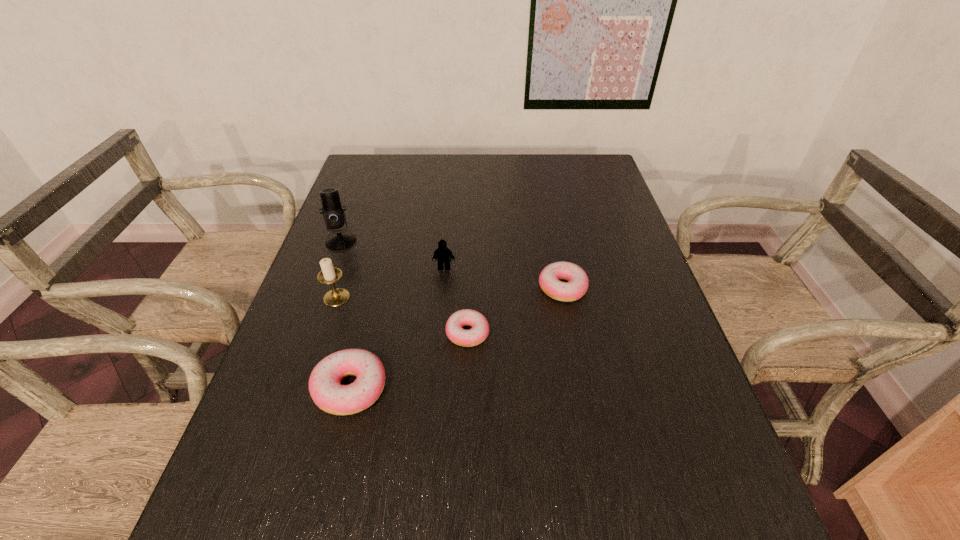
Identify the location of blank area at the far edge. The image size is (960, 540). (559, 177).

The height and width of the screenshot is (540, 960). I want to click on vacant position at the near edge of the desktop, so click(x=528, y=449).

In the image, there is a desktop. Where is `free region at the left edge`? The width and height of the screenshot is (960, 540). free region at the left edge is located at coordinates (378, 234).

This screenshot has height=540, width=960. Identify the location of free spot at the right edge of the desktop. (579, 202).

I want to click on vacant space at the far left corner, so click(393, 157).

In the image, there is a desktop. Where is `vacant region at the far right corner`? This screenshot has width=960, height=540. vacant region at the far right corner is located at coordinates (572, 182).

Find the location of `free space between the tallest doughnut and the shortest object`. free space between the tallest doughnut and the shortest object is located at coordinates (409, 361).

Locate an element on the screen. free space between the microphone and the Lego is located at coordinates (393, 254).

Locate an element on the screen. Image resolution: width=960 pixels, height=540 pixels. vacant area between the second tallest object and the rightmost object is located at coordinates (449, 293).

Identify the location of empty space that is in between the rightmost doughnut and the fifth shortest object. The height and width of the screenshot is (540, 960). (449, 293).